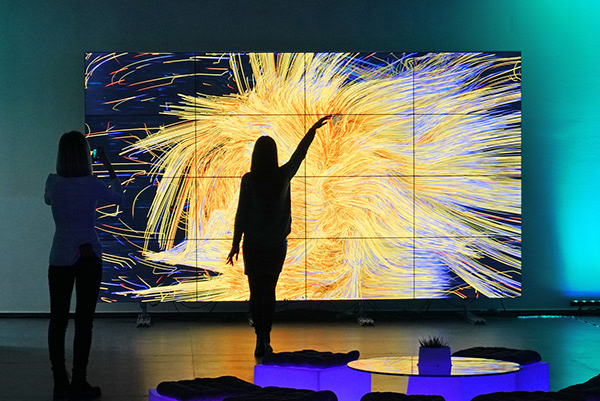
Where is `indoor plant`? The width and height of the screenshot is (600, 401). indoor plant is located at coordinates (436, 352).